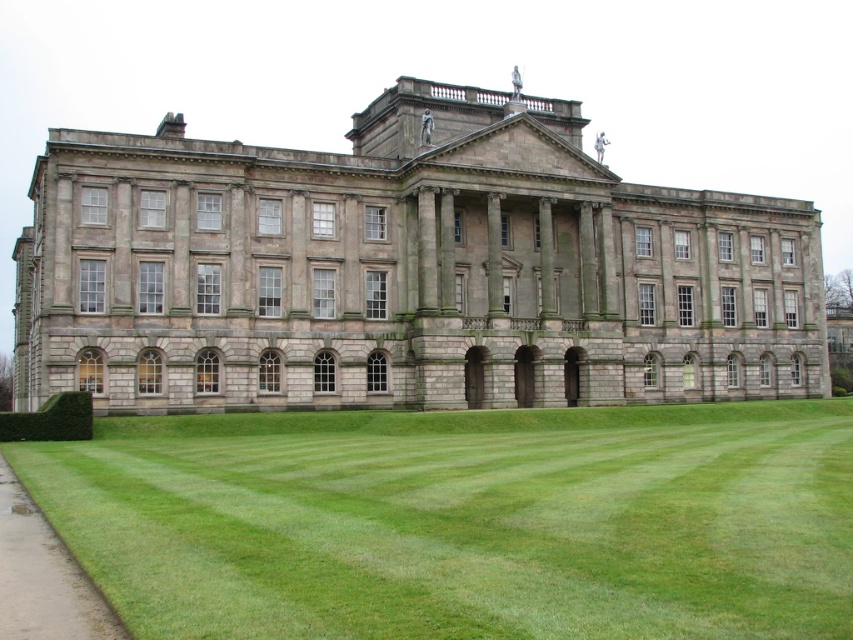
Is gray stone palace at center taller than green grass at lower center?

Yes, gray stone palace at center is taller than green grass at lower center.

In the scene shown: Can you confirm if gray stone palace at center is positioned to the right of green grass at lower center?

In fact, gray stone palace at center is to the left of green grass at lower center.

What do you see at coordinates (404, 269) in the screenshot? I see `gray stone palace at center` at bounding box center [404, 269].

Locate an element on the screen. Image resolution: width=853 pixels, height=640 pixels. gray stone palace at center is located at coordinates (404, 269).